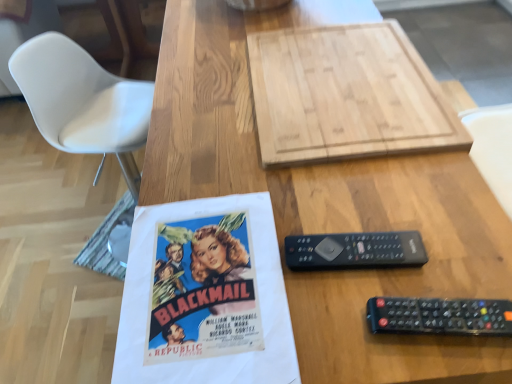
This screenshot has height=384, width=512. Identify the location of vacant space to the left of black plastic remote at lower right. (303, 310).